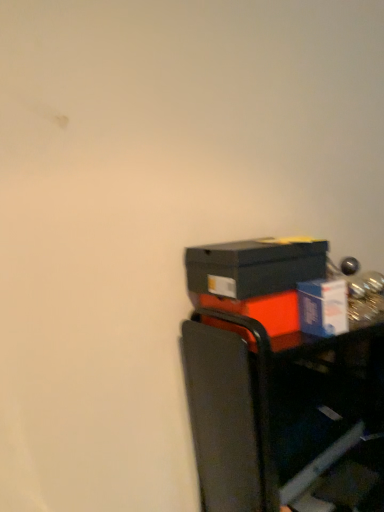
Question: From the image's perspective, is orange matte box at right, which appears as the first box when ordered from the bottom, above or below metallic black cart at lower right?

Choices:
 (A) below
 (B) above

Answer: (B)

Question: Is orange matte box at right, which appears as the first box when ordered from the bottom, inside or outside of metallic black cart at lower right?

Choices:
 (A) outside
 (B) inside

Answer: (A)

Question: Estimate the real-world distances between objects in this image. Which object is closer to the orange matte box at right, which appears as the 3th box when viewed from the top?

Choices:
 (A) matte black box at right, positioned as the 1th box in top-to-bottom order
 (B) metallic black cart at lower right
 (C) blue cardboard box at right, which is counted as the 2th box, starting from the top

Answer: (A)

Question: Based on their relative distances, which object is nearer to the metallic black cart at lower right?

Choices:
 (A) orange matte box at right, which appears as the first box when ordered from the bottom
 (B) matte black box at right, which is the third box in bottom-to-top order
 (C) blue cardboard box at right, arranged as the 2th box when ordered from the bottom

Answer: (A)